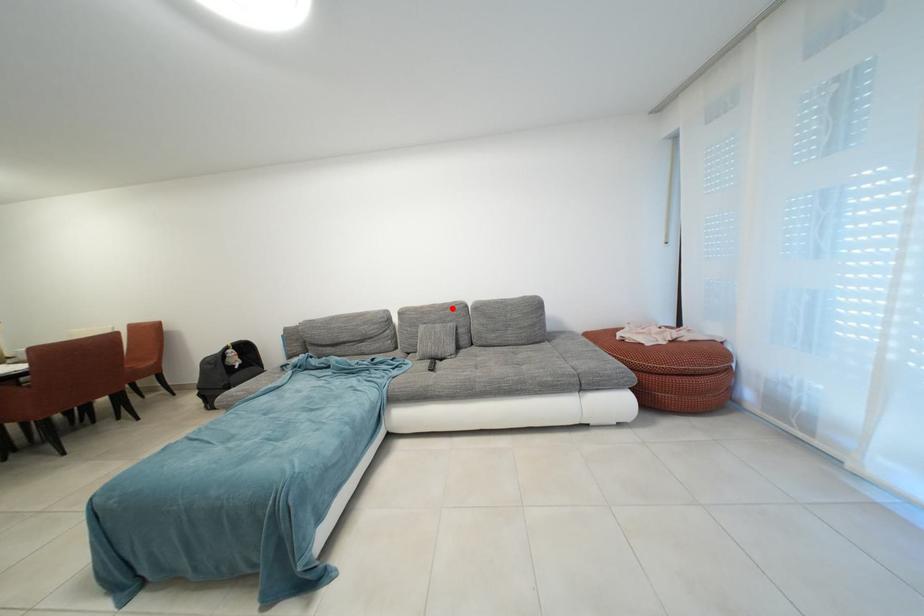
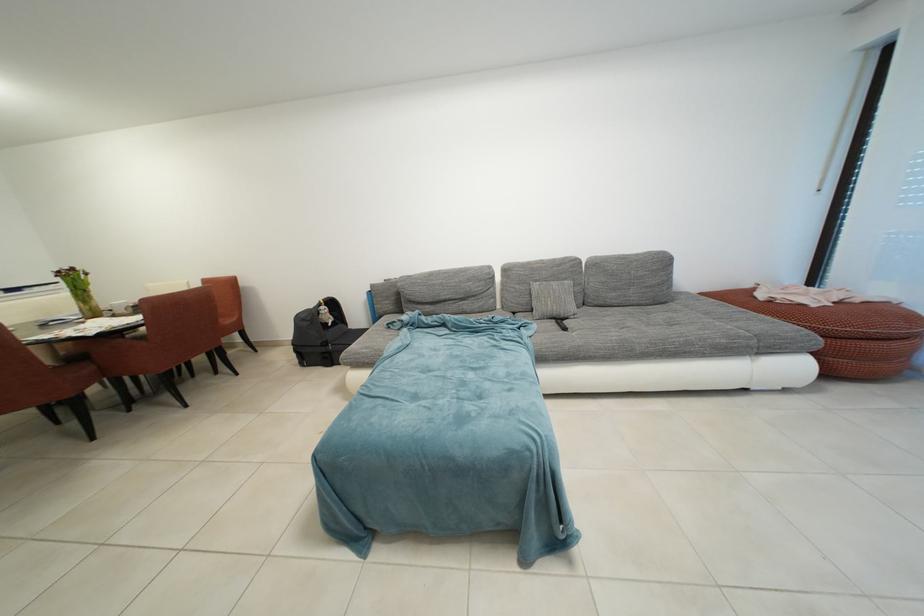
Question: I am providing you with two images of the same scene from different viewpoints. A red point is shown in image1. For the corresponding object point in image2, is it positioned nearer or farther from the camera?

Choices:
 (A) Nearer
 (B) Farther

Answer: (A)